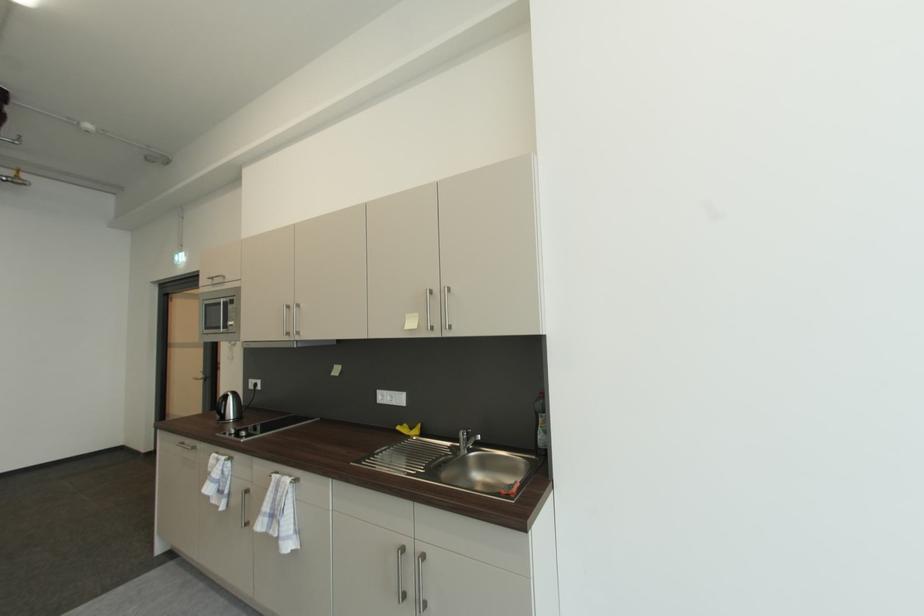
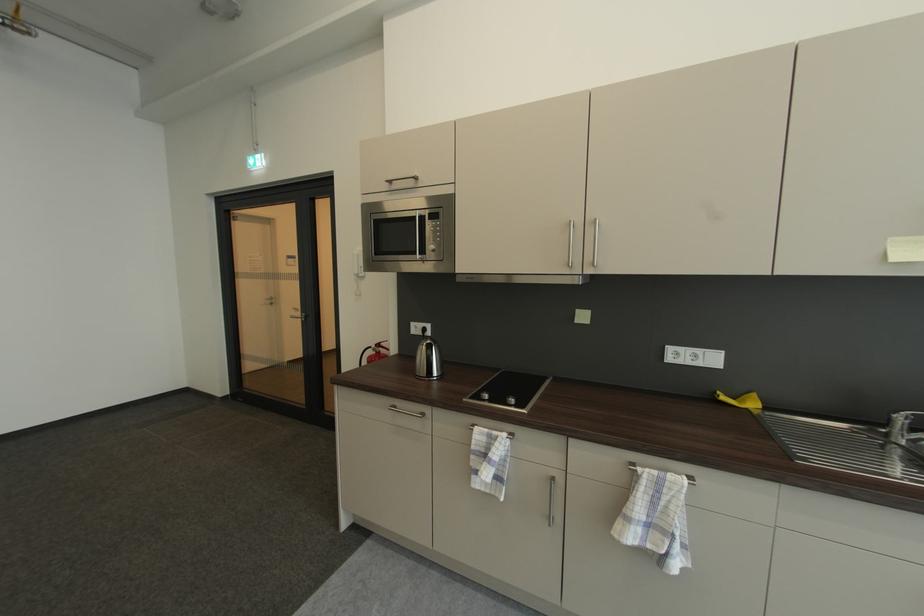
The point at (233, 329) is marked in the first image. Where is the corresponding point in the second image?

(430, 254)